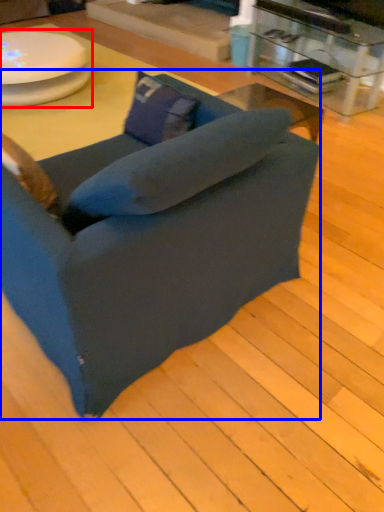
Question: Which object appears closest to the camera in this image, round table (highlighted by a red box) or chair (highlighted by a blue box)?

Choices:
 (A) round table
 (B) chair

Answer: (B)